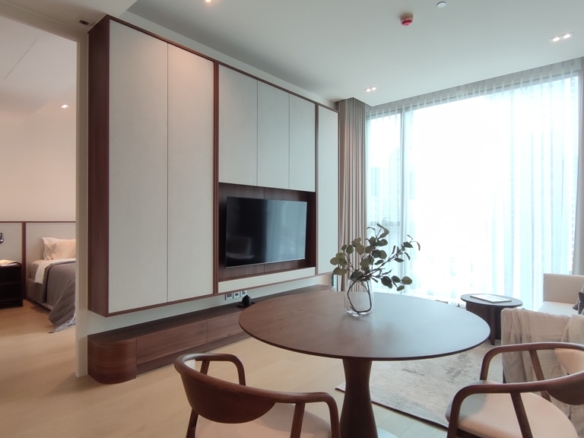
In order to click on chair in this screenshot , I will do `click(527, 414)`, `click(215, 403)`.